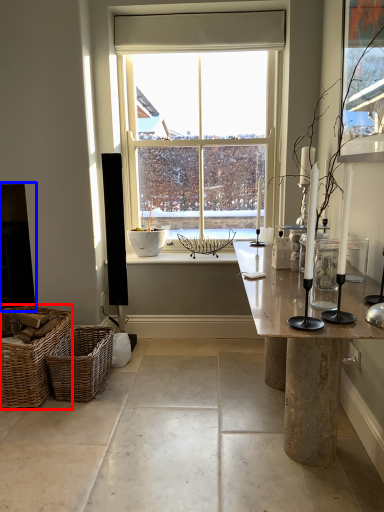
Question: Among these objects, which one is nearest to the camera, picnic basket (highlighted by a red box) or fireplace (highlighted by a blue box)?

Choices:
 (A) picnic basket
 (B) fireplace

Answer: (A)